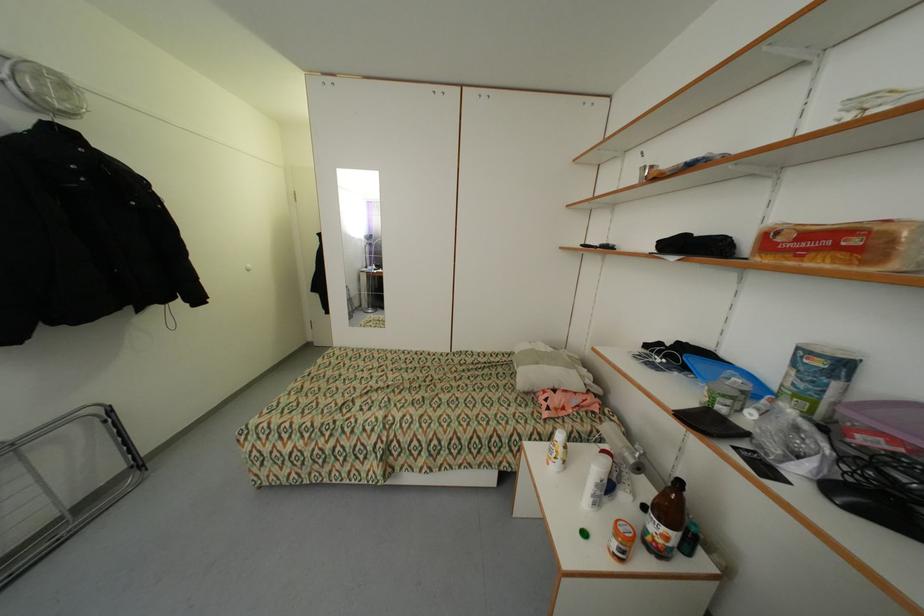
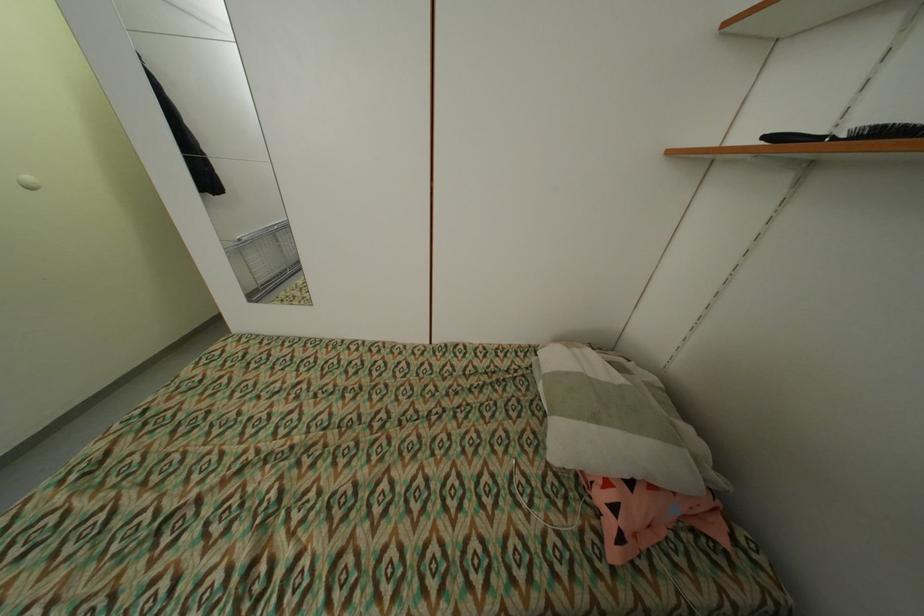
The point at (548, 400) is marked in the first image. Where is the corresponding point in the second image?

(606, 498)